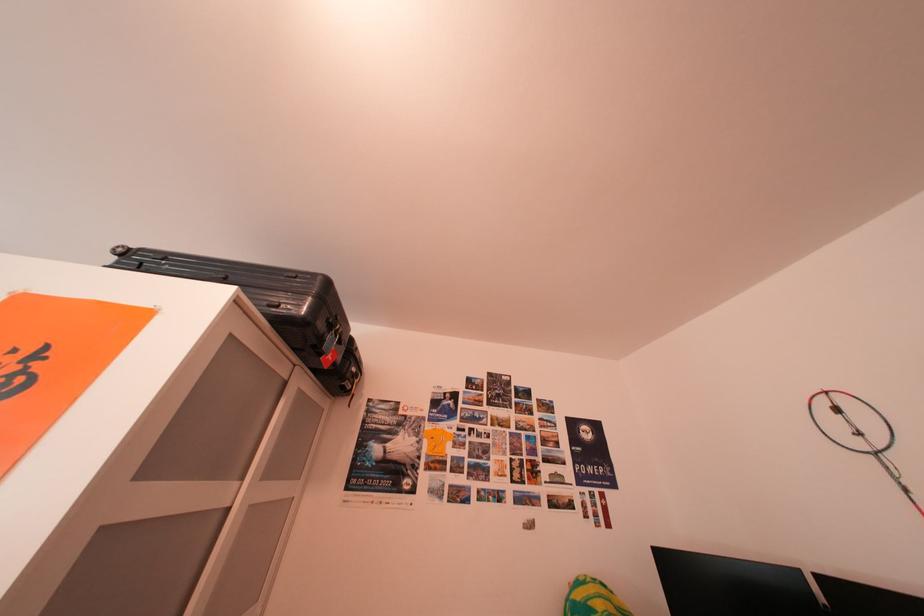
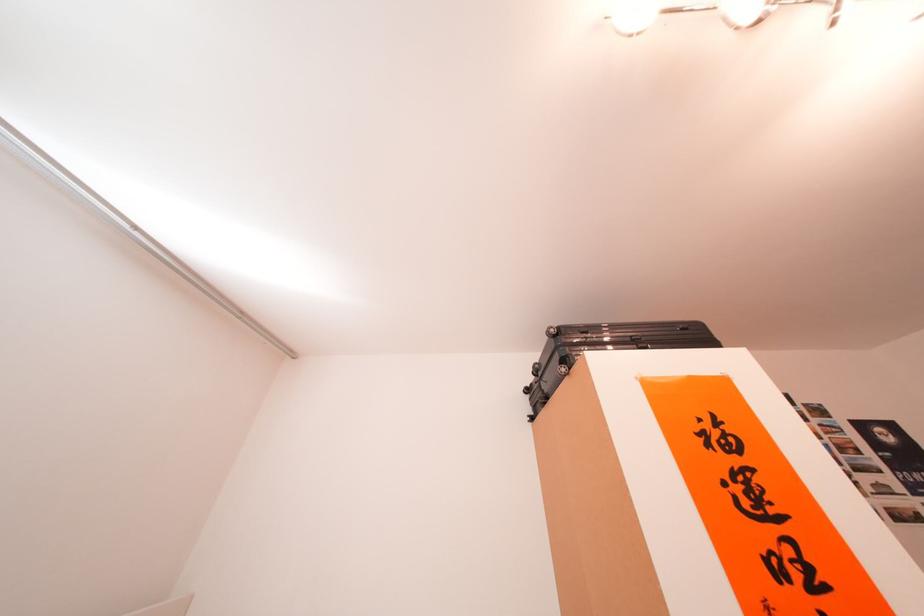
Question: Which direction would the cameraman need to move to produce the second image? Reply with the corresponding letter.

Choices:
 (A) Left
 (B) Right
 (C) Forward
 (D) Backward

Answer: (A)